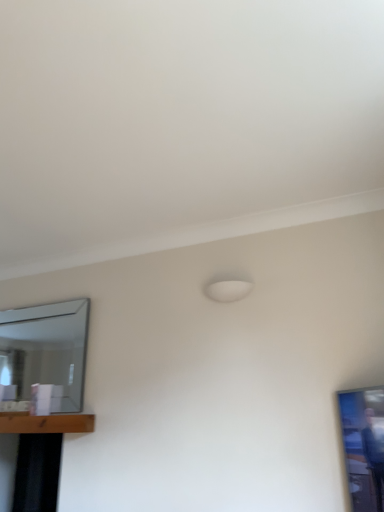
Question: Is clear glass mirror at left bigger than brown wooden table at lower left, which appears as the first table when viewed from the top?

Choices:
 (A) no
 (B) yes

Answer: (B)

Question: From a real-world perspective, is clear glass mirror at left beneath brown wooden table at lower left, which appears as the first table when viewed from the top?

Choices:
 (A) yes
 (B) no

Answer: (B)

Question: Is clear glass mirror at left not inside brown wooden table at lower left, which appears as the first table when viewed from the top?

Choices:
 (A) yes
 (B) no

Answer: (A)

Question: Can you confirm if clear glass mirror at left is positioned to the left of brown wooden table at lower left, which appears as the first table when viewed from the top?

Choices:
 (A) no
 (B) yes

Answer: (B)

Question: Does clear glass mirror at left have a lesser height compared to brown wooden table at lower left, which is the second table from bottom to top?

Choices:
 (A) no
 (B) yes

Answer: (A)

Question: Are clear glass mirror at left and brown wooden table at lower left, which is the second table from bottom to top, far apart?

Choices:
 (A) yes
 (B) no

Answer: (B)

Question: Does clear glass mirror at left turn towards black matte table at lower left, positioned as the second table in top-to-bottom order?

Choices:
 (A) yes
 (B) no

Answer: (B)

Question: From a real-world perspective, is clear glass mirror at left located beneath black matte table at lower left, positioned as the second table in top-to-bottom order?

Choices:
 (A) yes
 (B) no

Answer: (B)

Question: Is clear glass mirror at left taller than black matte table at lower left, the 1th table ordered from the bottom?

Choices:
 (A) no
 (B) yes

Answer: (B)

Question: Can you confirm if clear glass mirror at left is shorter than black matte table at lower left, positioned as the second table in top-to-bottom order?

Choices:
 (A) yes
 (B) no

Answer: (B)

Question: From the image's perspective, is clear glass mirror at left under black matte table at lower left, positioned as the second table in top-to-bottom order?

Choices:
 (A) yes
 (B) no

Answer: (B)

Question: Is clear glass mirror at left turned away from black matte table at lower left, positioned as the second table in top-to-bottom order?

Choices:
 (A) no
 (B) yes

Answer: (A)

Question: Considering the relative positions of brown wooden table at lower left, which appears as the first table when viewed from the top, and black matte table at lower left, positioned as the second table in top-to-bottom order, in the image provided, is brown wooden table at lower left, which appears as the first table when viewed from the top, behind black matte table at lower left, positioned as the second table in top-to-bottom order,?

Choices:
 (A) no
 (B) yes

Answer: (A)